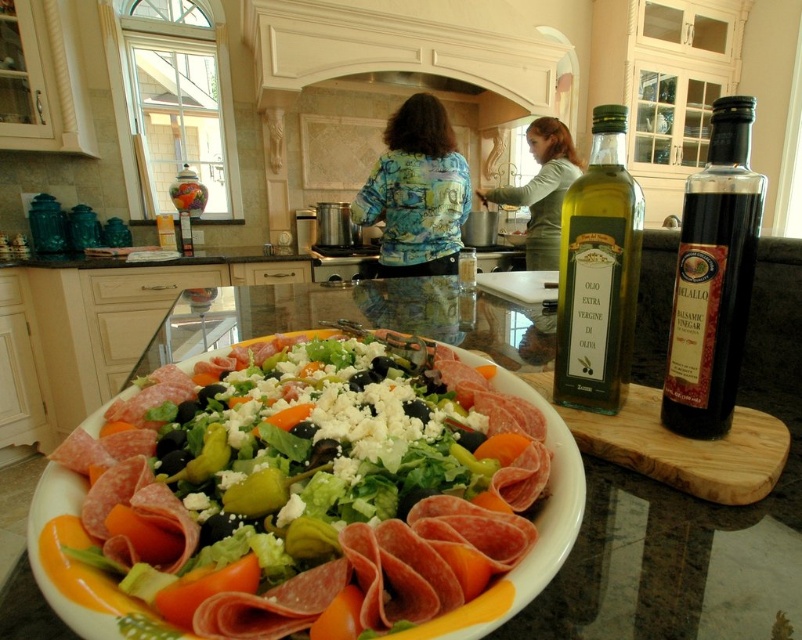
You are standing in the kitchen and want to reach both the point at coordinates point [432,410] and the point at coordinates point [539,221]. Which point should you approach first to reach the one closer to you?

You should approach point [432,410] first because it is closer to you than point [539,221].

You are holding a 10 inch ruler and want to measure the distance from the camera to the point at coordinates (636,611). Can your ruler reach that distance?

The point at coordinates (636,611) is 12.39 inches from the camera, so the 10 inch ruler cannot reach that distance.